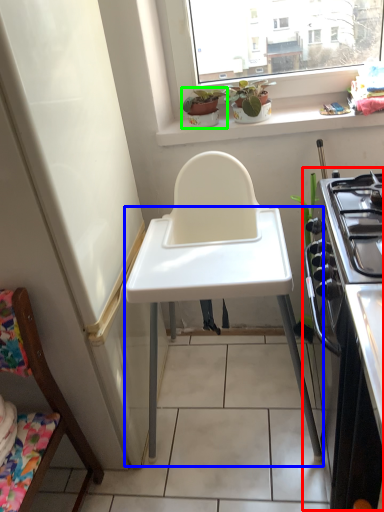
Question: Based on their relative distances, which object is nearer to appliance (highlighted by a red box)? Choose from table (highlighted by a blue box) and houseplant (highlighted by a green box).

Choices:
 (A) table
 (B) houseplant

Answer: (A)